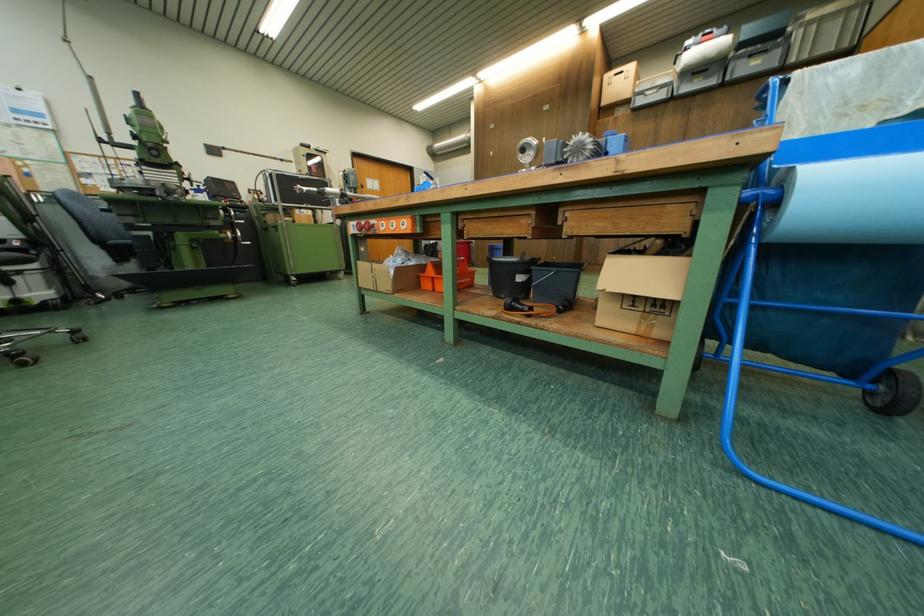
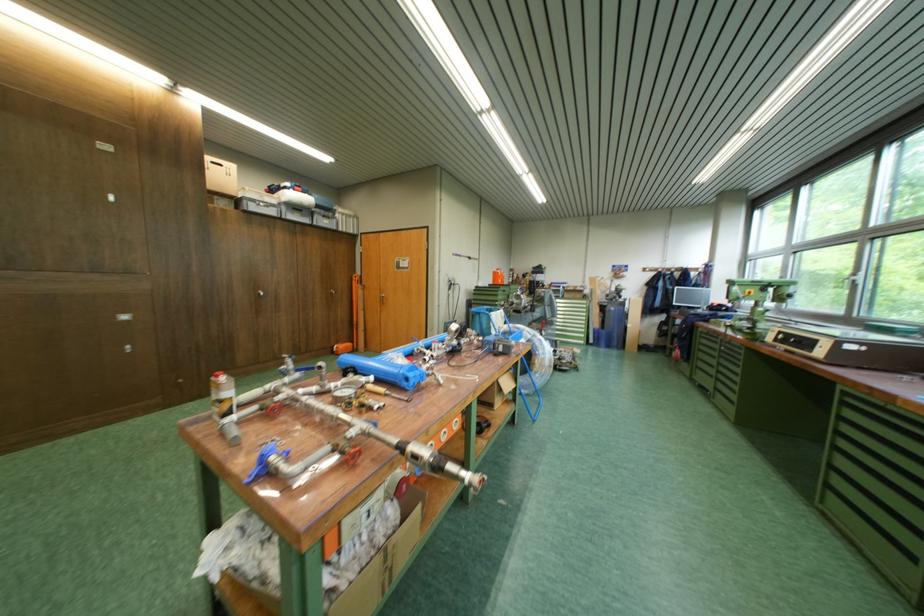
In the second image, find the point that corresponds to point 554,111 in the first image.

(110, 150)